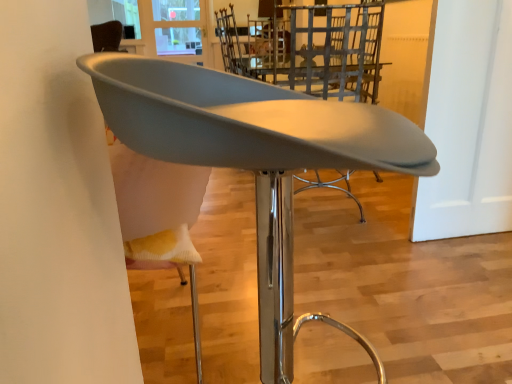
Question: Can you confirm if transparent glass window at upper center is smaller than metallic silver chair at center, which appears as the second chair when viewed from the front?

Choices:
 (A) no
 (B) yes

Answer: (B)

Question: Does transparent glass window at upper center touch metallic silver chair at center, which appears as the second chair when viewed from the front?

Choices:
 (A) yes
 (B) no

Answer: (B)

Question: Is transparent glass window at upper center outside of metallic silver chair at center, which appears as the second chair when viewed from the front?

Choices:
 (A) yes
 (B) no

Answer: (A)

Question: Is transparent glass window at upper center oriented away from metallic silver chair at center, which ranks as the 1th chair in back-to-front order?

Choices:
 (A) no
 (B) yes

Answer: (A)

Question: Is transparent glass window at upper center not near metallic silver chair at center, which appears as the second chair when viewed from the front?

Choices:
 (A) yes
 (B) no

Answer: (A)

Question: From the image's perspective, does transparent glass window at upper center appear higher than metallic silver chair at center, which appears as the second chair when viewed from the front?

Choices:
 (A) no
 (B) yes

Answer: (B)

Question: Considering the relative sizes of metallic silver chair at center, which ranks as the 1th chair in back-to-front order, and transparent glass window at upper center in the image provided, is metallic silver chair at center, which ranks as the 1th chair in back-to-front order, thinner than transparent glass window at upper center?

Choices:
 (A) no
 (B) yes

Answer: (A)

Question: From the image's perspective, does metallic silver chair at center, which appears as the second chair when viewed from the front, appear lower than transparent glass window at upper center?

Choices:
 (A) no
 (B) yes

Answer: (B)

Question: Is metallic silver chair at center, which appears as the second chair when viewed from the front, wider than transparent glass window at upper center?

Choices:
 (A) yes
 (B) no

Answer: (A)

Question: Considering the relative positions of metallic silver chair at center, which ranks as the 1th chair in back-to-front order, and transparent glass window at upper center in the image provided, is metallic silver chair at center, which ranks as the 1th chair in back-to-front order, behind transparent glass window at upper center?

Choices:
 (A) no
 (B) yes

Answer: (A)

Question: Can you confirm if metallic silver chair at center, which appears as the second chair when viewed from the front, is bigger than transparent glass window at upper center?

Choices:
 (A) no
 (B) yes

Answer: (B)

Question: Is metallic silver chair at center, which appears as the second chair when viewed from the front, at the left side of transparent glass window at upper center?

Choices:
 (A) no
 (B) yes

Answer: (A)

Question: Is matte gray chair at center, the first chair from the front, wider than metallic silver chair at center, which ranks as the 1th chair in back-to-front order?

Choices:
 (A) yes
 (B) no

Answer: (B)